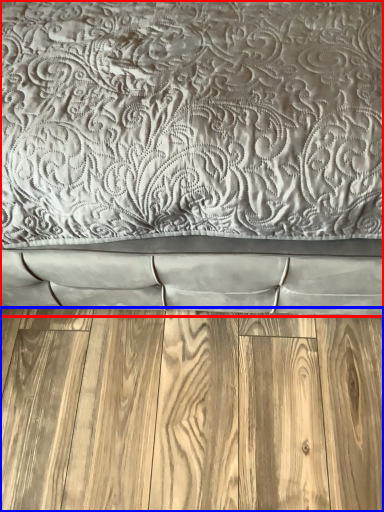
Question: Which of the following is the farthest to the observer, bed (highlighted by a red box) or hardwood (highlighted by a blue box)?

Choices:
 (A) bed
 (B) hardwood

Answer: (B)